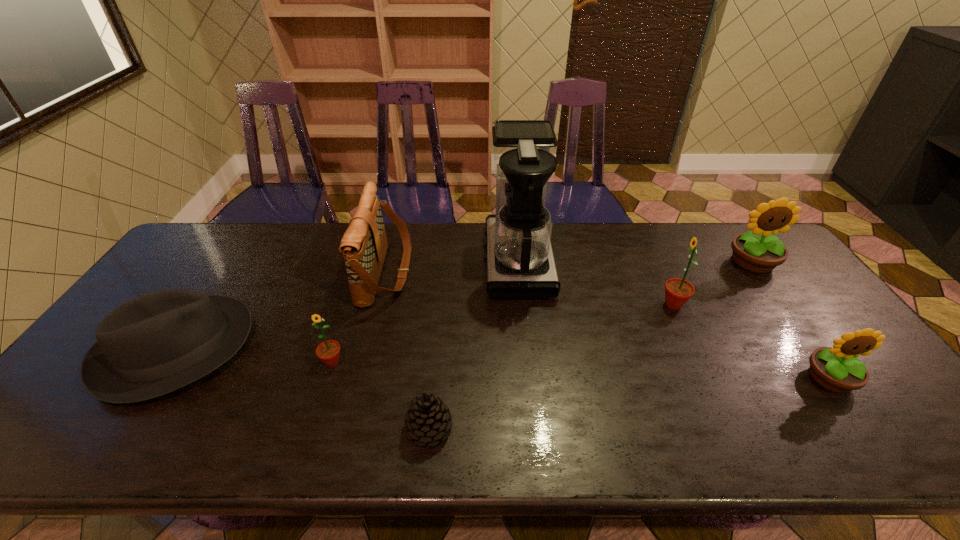
In order to click on the second shortest object in this screenshot , I will do coord(154,344).

The image size is (960, 540). In order to click on gray fedora in this screenshot , I will do `click(154, 344)`.

What are the coordinates of `the shortest object` in the screenshot? It's located at (427, 419).

The height and width of the screenshot is (540, 960). Find the location of `pinecone`. pinecone is located at coordinates (427, 419).

You are a GUI agent. You are given a task and a screenshot of the screen. Output one action in this format:
    pyautogui.click(x=<x>, y=<y>)
    Task: Click on the vacant space located at the front of the tallest object where the controls are located
    Image resolution: width=960 pixels, height=540 pixels.
    Given the screenshot: What is the action you would take?
    pyautogui.click(x=431, y=261)

I want to click on vacant area located 0.160m at the front of the tallest object where the controls are located, so click(x=434, y=261).

At what (x,y) coordinates should I click in order to perform the action: click on vacant area located at the front of the tallest object where the controls are located. Please return your answer as a coordinate pair (x, y). The width and height of the screenshot is (960, 540). Looking at the image, I should click on (400, 261).

Locate an element on the screen. This screenshot has height=540, width=960. free point located 0.280m on the face of the bigger yellow sunflower is located at coordinates (815, 348).

Identify the location of free space located 0.140m on the face of the sixth object from left to right. The height and width of the screenshot is (540, 960). (612, 305).

The width and height of the screenshot is (960, 540). In order to click on free location located 0.210m on the face of the sixth object from left to right in this screenshot , I will do `click(588, 305)`.